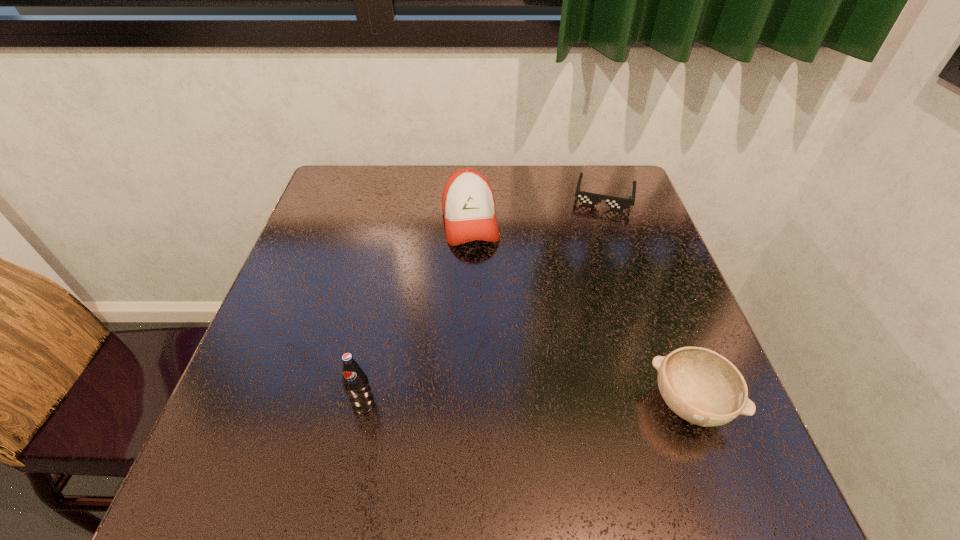
In order to click on vacant space located 0.220m on the front-facing side of the shortest object in this screenshot , I will do (x=590, y=266).

At what (x,y) coordinates should I click in order to perform the action: click on vacant space located 0.390m on the front-facing side of the shortest object. Please return your answer as a coordinate pair (x, y). The image size is (960, 540). Looking at the image, I should click on pos(582,319).

Where is `blank space located 0.120m on the front-facing side of the shortest object`? blank space located 0.120m on the front-facing side of the shortest object is located at coordinates [595, 240].

Locate an element on the screen. Image resolution: width=960 pixels, height=540 pixels. baseball cap that is at the far edge is located at coordinates (468, 204).

The height and width of the screenshot is (540, 960). Find the location of `sunglasses present at the far edge`. sunglasses present at the far edge is located at coordinates (590, 199).

At what (x,y) coordinates should I click in order to perform the action: click on pop that is positioned at the near edge. Please return your answer as a coordinate pair (x, y). The image size is (960, 540). Looking at the image, I should click on (355, 381).

The image size is (960, 540). Identify the location of bowl at the near edge. (701, 386).

Find the location of a particular element. bowl at the right edge is located at coordinates (701, 386).

At what (x,y) coordinates should I click in order to perform the action: click on sunglasses that is positioned at the right edge. Please return your answer as a coordinate pair (x, y). The width and height of the screenshot is (960, 540). Looking at the image, I should click on (590, 199).

Where is `object positioned at the far right corner`? This screenshot has width=960, height=540. object positioned at the far right corner is located at coordinates (590, 199).